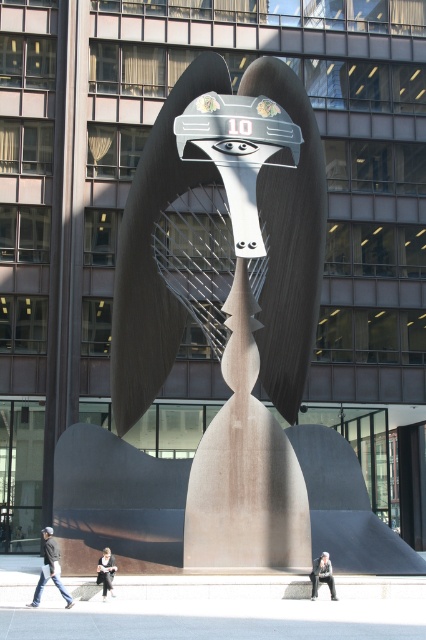
You are an urban planner analyzing the sculpture in the plaza. The point labeled with coordinates point (117,502) is marked on the sculpture. Based on the sculpture description, where on the sculpture would this point most likely be located?

The point (117,502) is on the matte bronze sculpture at center, which has a wide rounded head with a flat top and a rectangular visor displaying the number 10 and two eye symbols. This point is likely located on the rectangular visor area since it is positioned at the top of the head section.

You are an urban planner assessing the plaza layout. You notice the dark blue jeans at lower left and the dark gray concrete figure at center. Which object takes up more space in the scene?

The dark blue jeans at lower left is larger in size than the dark gray concrete figure at center, so it takes up more space in the scene.